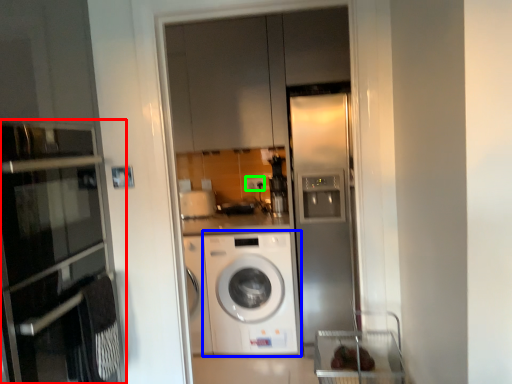
Question: Which object is positioned farthest from oven (highlighted by a red box)? Select from washing machine (highlighted by a blue box) and electric outlet (highlighted by a green box).

Choices:
 (A) washing machine
 (B) electric outlet

Answer: (B)